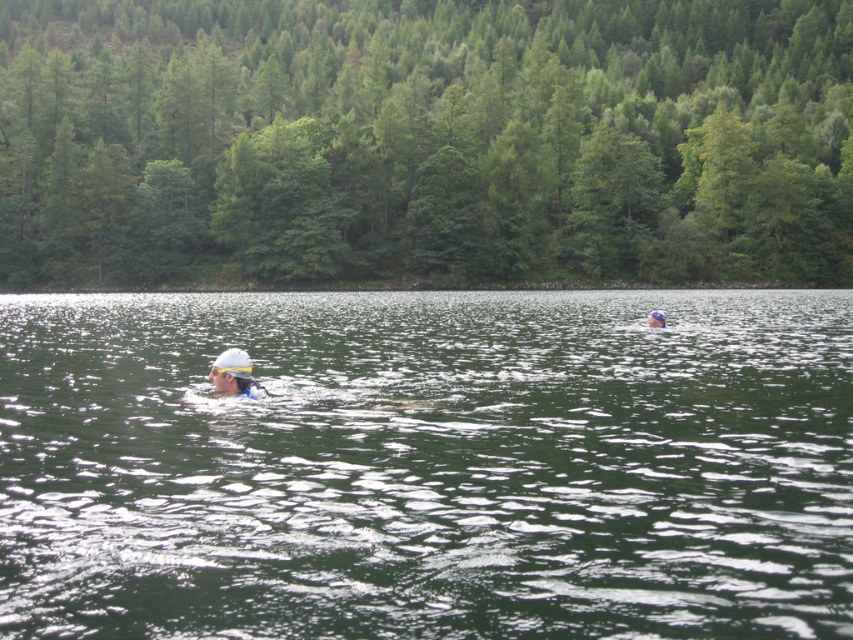
Question: Does green liquid water at center appear on the right side of white matte swim cap at center?

Choices:
 (A) yes
 (B) no

Answer: (A)

Question: Which is nearer to the green leafy trees at upper center?

Choices:
 (A) white matte swim cap at upper center
 (B) white matte swim cap at center
 (C) green liquid water at center

Answer: (C)

Question: Which object is the farthest from the white matte swim cap at upper center?

Choices:
 (A) green leafy trees at upper center
 (B) green liquid water at center
 (C) white matte swim cap at center

Answer: (A)

Question: Is green liquid water at center positioned behind green leafy trees at upper center?

Choices:
 (A) no
 (B) yes

Answer: (A)

Question: Does green liquid water at center appear on the right side of white matte swim cap at center?

Choices:
 (A) yes
 (B) no

Answer: (A)

Question: Based on their relative distances, which object is nearer to the white matte swim cap at center?

Choices:
 (A) green liquid water at center
 (B) white matte swim cap at upper center

Answer: (A)